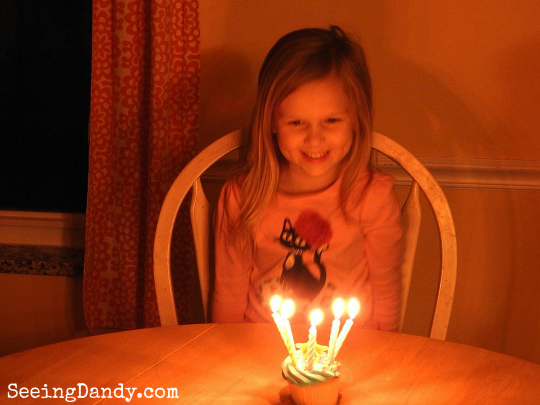
The image size is (540, 405). I want to click on wooden chair back, so click(x=411, y=167).